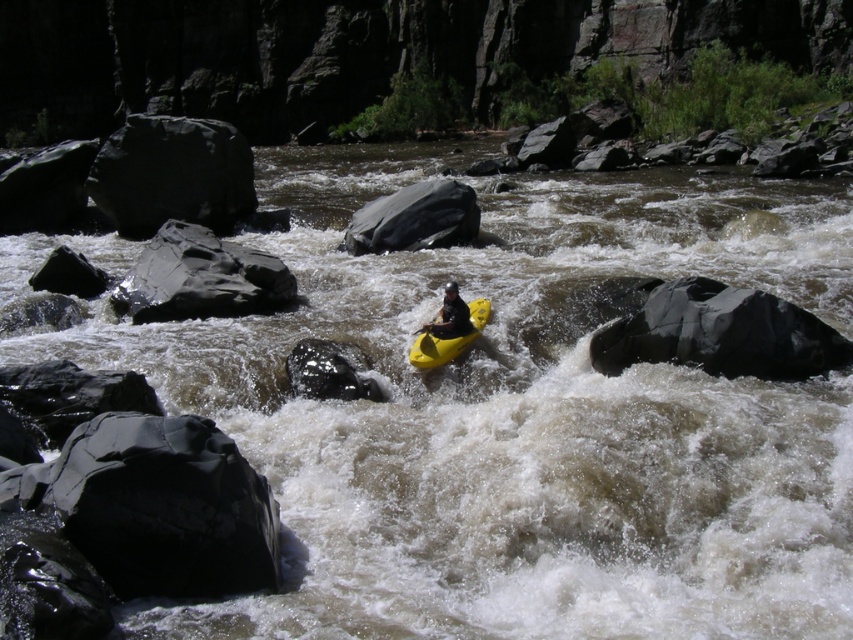
Does yellow rubber canoe at center have a lesser height compared to yellow rubber paddle at center?

No, yellow rubber canoe at center is not shorter than yellow rubber paddle at center.

Between point (425, 344) and point (439, 323), which one is positioned behind?

Positioned behind is point (439, 323).

Where is `yellow rubber canoe at center`? This screenshot has width=853, height=640. yellow rubber canoe at center is located at coordinates (447, 339).

Which is more to the left, black rubber boulder at lower right or smooth gray rock at left?

smooth gray rock at left

In the scene shown: Is black rubber boulder at lower right wider than smooth gray rock at left?

Yes, black rubber boulder at lower right is wider than smooth gray rock at left.

Describe the element at coordinates (718, 332) in the screenshot. The height and width of the screenshot is (640, 853). I see `black rubber boulder at lower right` at that location.

This screenshot has height=640, width=853. What are the coordinates of `black rubber boulder at lower right` in the screenshot? It's located at (718, 332).

Image resolution: width=853 pixels, height=640 pixels. What do you see at coordinates (718, 332) in the screenshot?
I see `black rubber boulder at lower right` at bounding box center [718, 332].

Is point (814, 365) positioned in front of point (468, 202)?

Yes, it is in front of point (468, 202).

Locate an element on the screen. black rubber boulder at lower right is located at coordinates (718, 332).